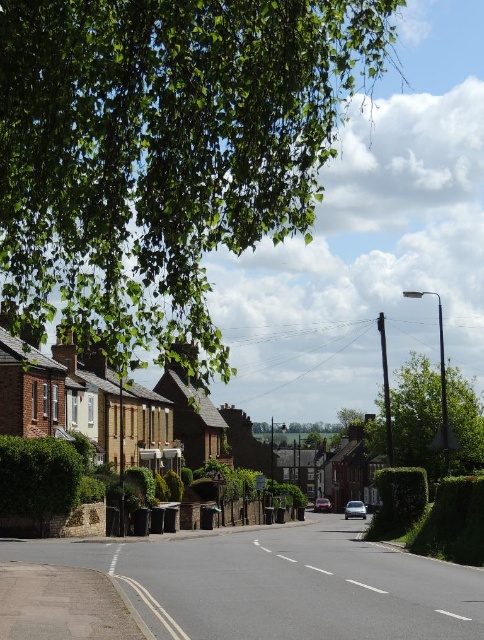
You are a delivery driver who needs to park your car without blocking the white plastic street sign at center. Can you park your silver metallic car at center in its current position?

The silver metallic car at center is positioned under the white plastic street sign at center, so parking it there would block the sign. Choose a different spot.

You are a delivery driver who needs to park your metallic silver car at center as close as possible to the green leafy tree at upper left without blocking the road. What is the minimum distance you can park the car from the tree?

The minimum distance you can park the metallic silver car at center from the green leafy tree at upper left is 67.90 meters, as that is the closest they can be without blocking the road.